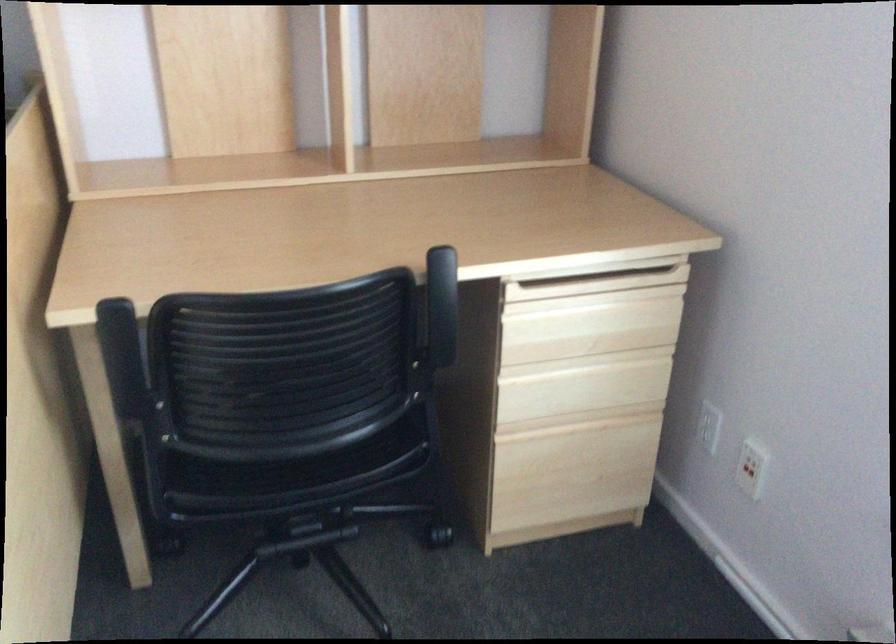
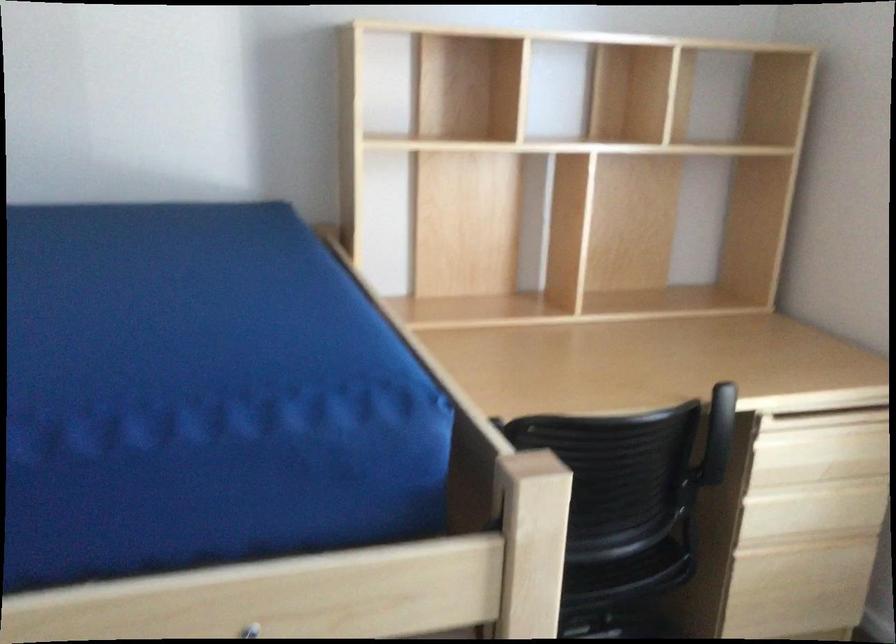
Locate, in the second image, the point that corresponds to [584,321] in the first image.

(819, 450)